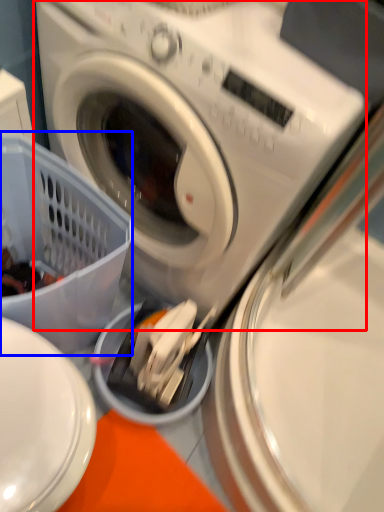
Question: Which object appears closest to the camera in this image, washing machine (highlighted by a red box) or basket (highlighted by a blue box)?

Choices:
 (A) washing machine
 (B) basket

Answer: (A)